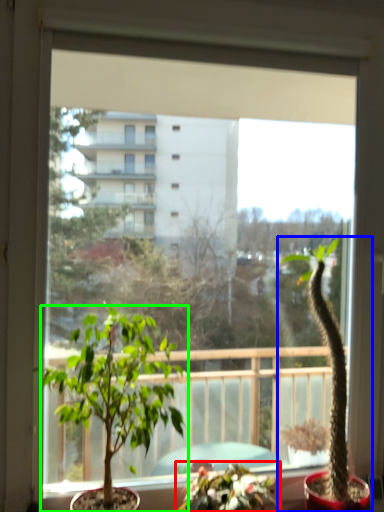
Question: Which object is positioned farthest from houseplant (highlighted by a red box)? Select from houseplant (highlighted by a blue box) and houseplant (highlighted by a green box).

Choices:
 (A) houseplant
 (B) houseplant

Answer: (B)